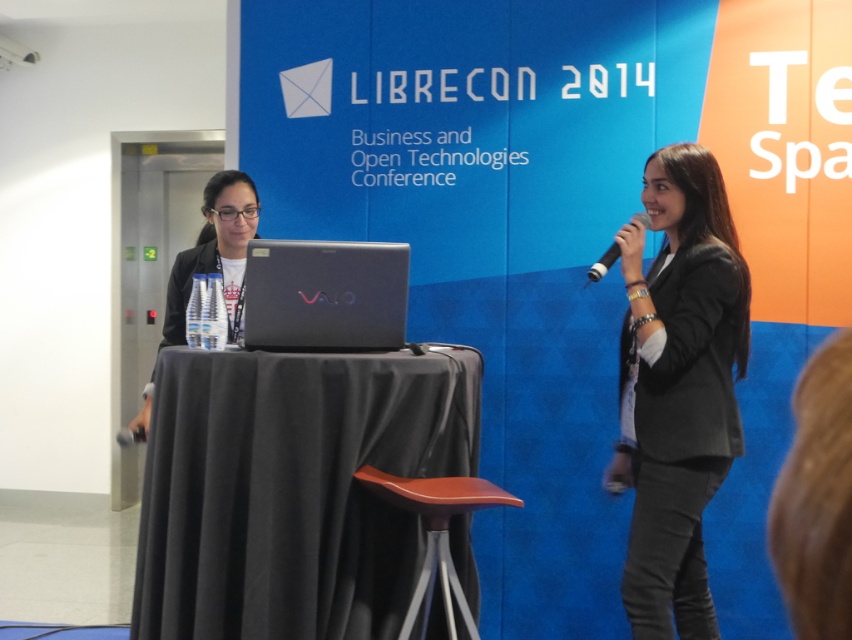
You are setting up for a presentation at LibreCon 2014. You have a black fabric table at center and a satin black laptop at center. Which object takes up more space on the table?

The black fabric table at center has a larger size compared to the satin black laptop at center, so the table occupies more space on the table.

You are setting up for a presentation and need to place a 12 inch tablet next to the matte black laptop at center on the black fabric table at center. Will there be enough space for both items side by side?

The black fabric table at center is wider than the matte black laptop at center, so there should be enough space to place a 12 inch tablet next to the laptop on the table.

You are a conference attendee who wants to place a name tag on the table without blocking the laptop. Given that the name tag is 3 inches wide, can you fit it between the black fabric table at center and the satin black laptop at center?

The black fabric table at center and the satin black laptop at center are 11.77 inches apart. Since the name tag is only 3 inches wide, there is sufficient space to place it between them without blocking the laptop.